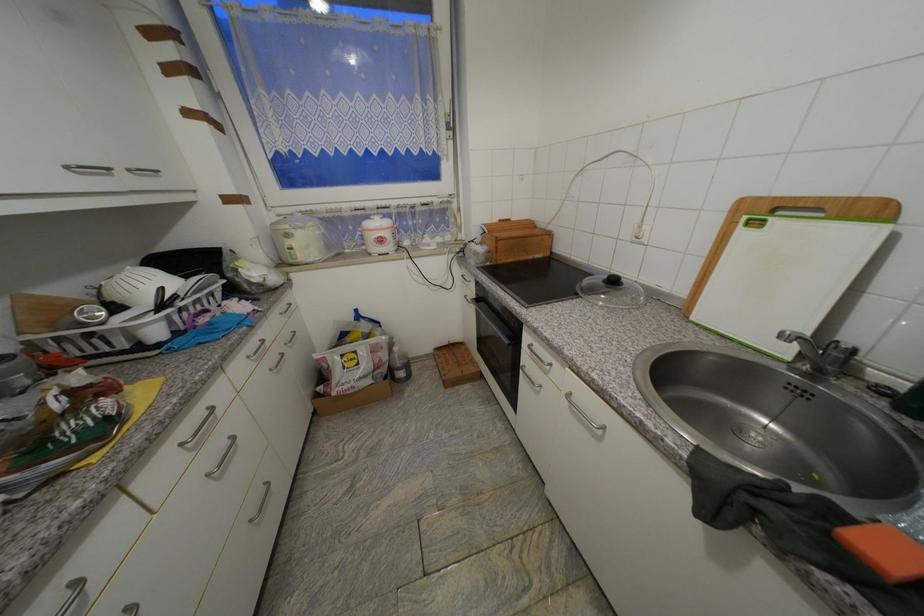
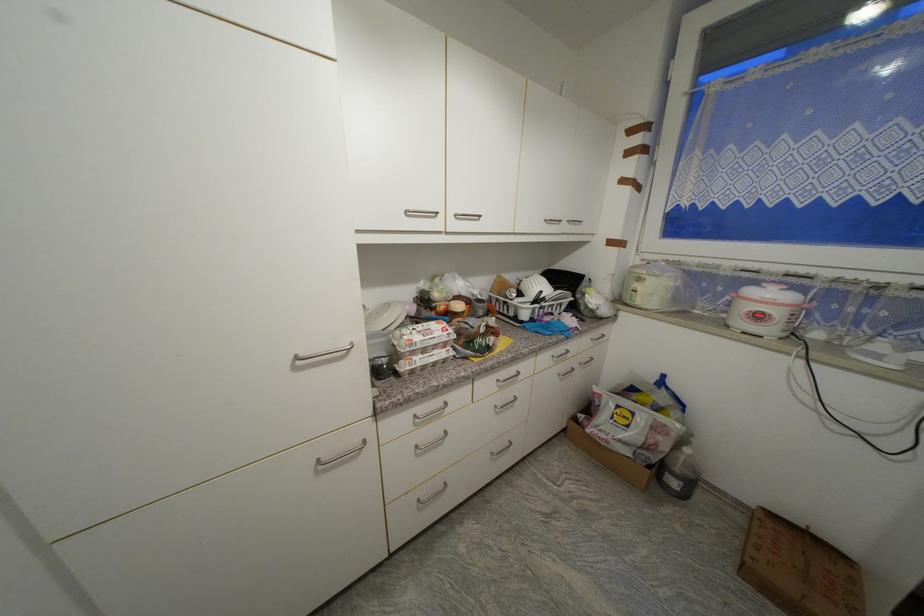
Question: The camera is either moving clockwise (left) or counter-clockwise (right) around the object. The first image is from the beginning of the video and the second image is from the end. Is the camera moving left or right when shooting the video?

Choices:
 (A) Left
 (B) Right

Answer: (B)